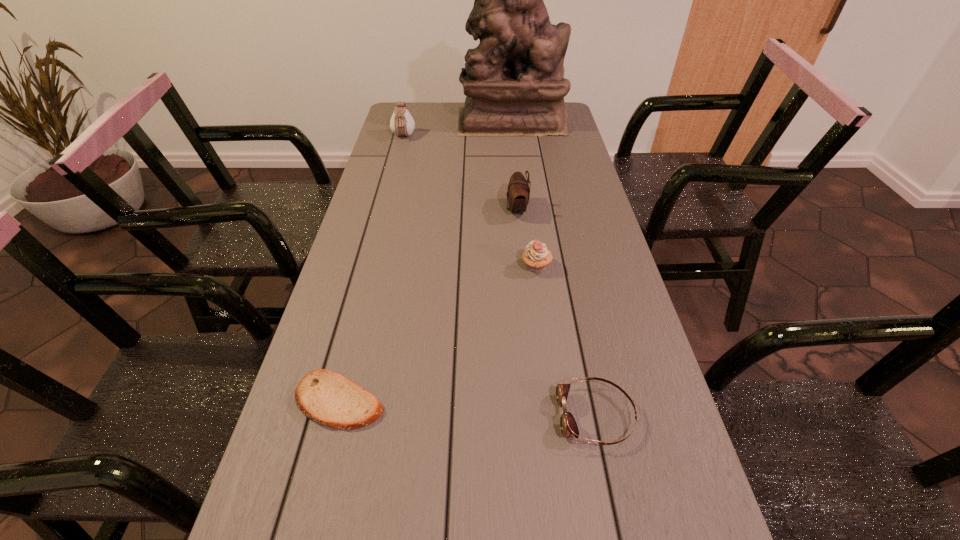
Find the location of a particular element. object at the far edge is located at coordinates (514, 81).

This screenshot has width=960, height=540. What are the coordinates of `pouch that is at the left edge` in the screenshot? It's located at click(x=401, y=123).

Identify the location of pita bread that is at the left edge. pos(328,398).

Where is `sculpture that is at the right edge`? sculpture that is at the right edge is located at coordinates (514, 81).

The width and height of the screenshot is (960, 540). Find the location of `goggles present at the right edge`. goggles present at the right edge is located at coordinates (568, 425).

The width and height of the screenshot is (960, 540). I want to click on object present at the far right corner, so click(x=514, y=81).

Image resolution: width=960 pixels, height=540 pixels. Identify the location of vacant position at the far edge of the desktop. (446, 119).

This screenshot has height=540, width=960. In the image, there is a desktop. Find the location of `vacant space at the left edge`. vacant space at the left edge is located at coordinates (380, 204).

Where is `vacant space at the right edge`? Image resolution: width=960 pixels, height=540 pixels. vacant space at the right edge is located at coordinates (612, 313).

Locate an element on the screen. free space at the far left corner is located at coordinates (420, 117).